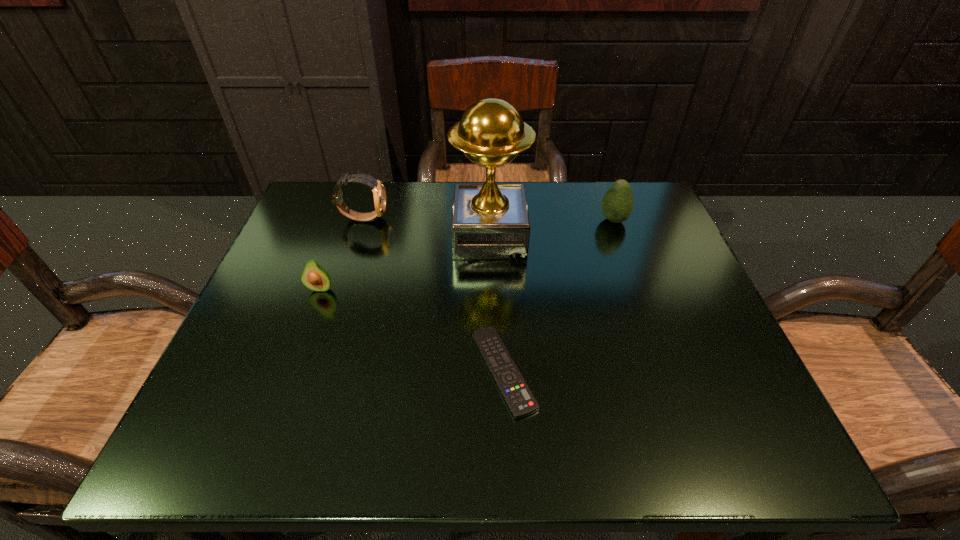
The image size is (960, 540). What are the coordinates of `avocado that is positioned at the left edge` in the screenshot? It's located at (314, 277).

Where is `object positioned at the right edge`? This screenshot has height=540, width=960. object positioned at the right edge is located at coordinates (617, 204).

Find the location of a particular element. This screenshot has height=540, width=960. object located at the far left corner is located at coordinates (379, 194).

This screenshot has width=960, height=540. Identify the location of object that is at the far right corner. (617, 204).

The image size is (960, 540). In the image, there is a desktop. Identify the location of free space at the far edge. (587, 186).

In the image, there is a desktop. Find the location of `vacant area at the near edge`. vacant area at the near edge is located at coordinates (551, 413).

At what (x,y) coordinates should I click in order to perform the action: click on vacant region at the right edge of the desktop. Please return your answer as a coordinate pair (x, y). The height and width of the screenshot is (540, 960). Looking at the image, I should click on (720, 330).

The width and height of the screenshot is (960, 540). In the image, there is a desktop. Find the location of `free space at the far left corner`. free space at the far left corner is located at coordinates (347, 193).

The height and width of the screenshot is (540, 960). What are the coordinates of `free region at the far right corner` in the screenshot? It's located at (652, 212).

Locate an element on the screen. This screenshot has width=960, height=540. free area in between the award and the remote control is located at coordinates (496, 303).